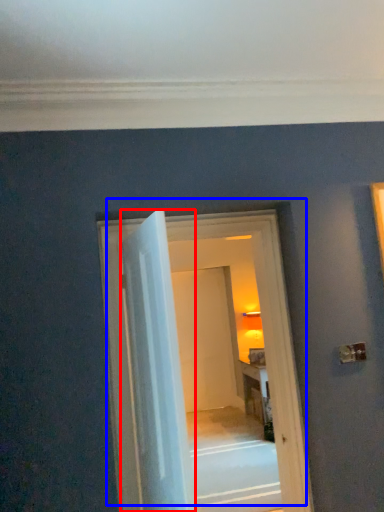
Question: Which object appears closest to the camera in this image, door (highlighted by a red box) or door (highlighted by a blue box)?

Choices:
 (A) door
 (B) door

Answer: (A)